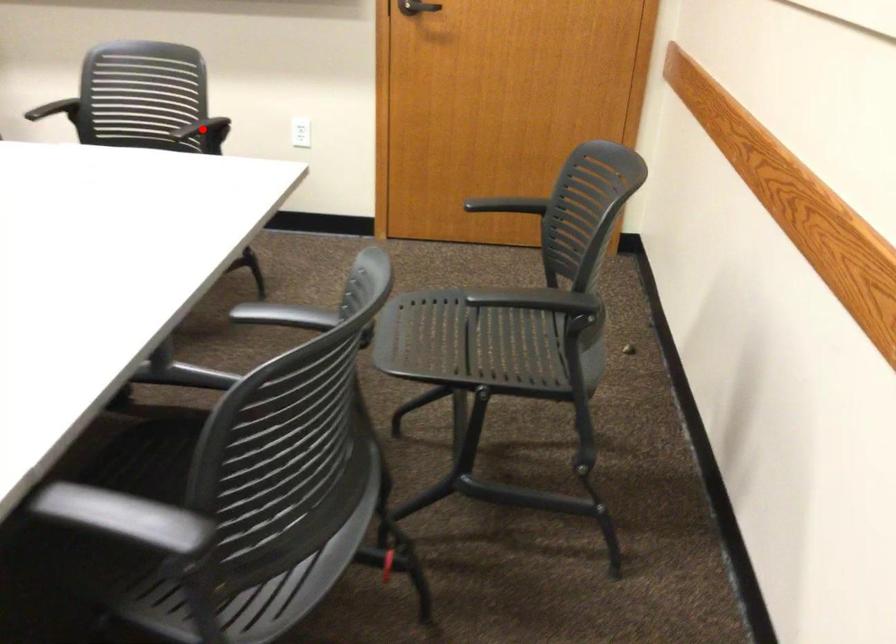
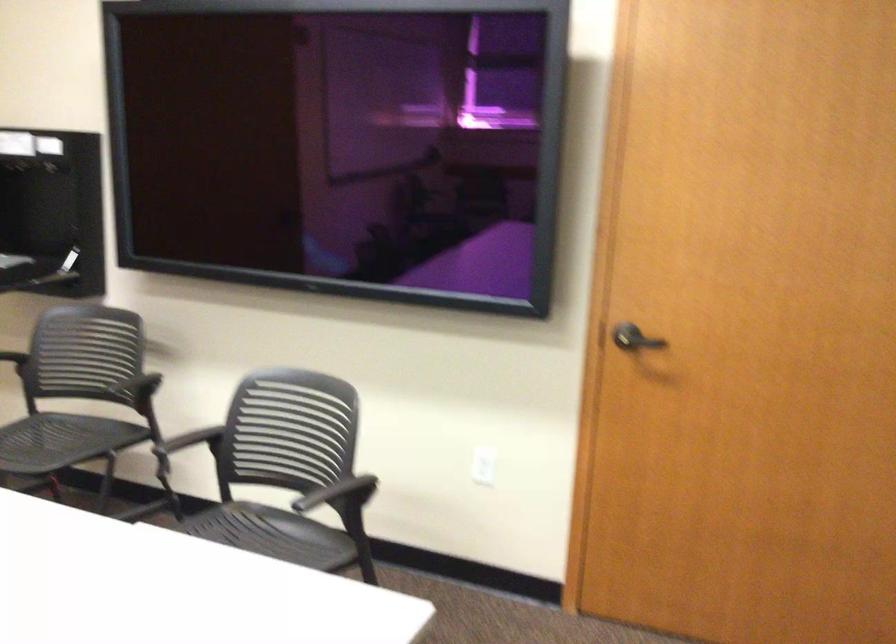
Question: A red point is marked in image1. In image2, is the corresponding 3D point closer to the camera or farther? Reply with the corresponding letter.

Choices:
 (A) The corresponding 3D point is closer.
 (B) The corresponding 3D point is farther.

Answer: (A)